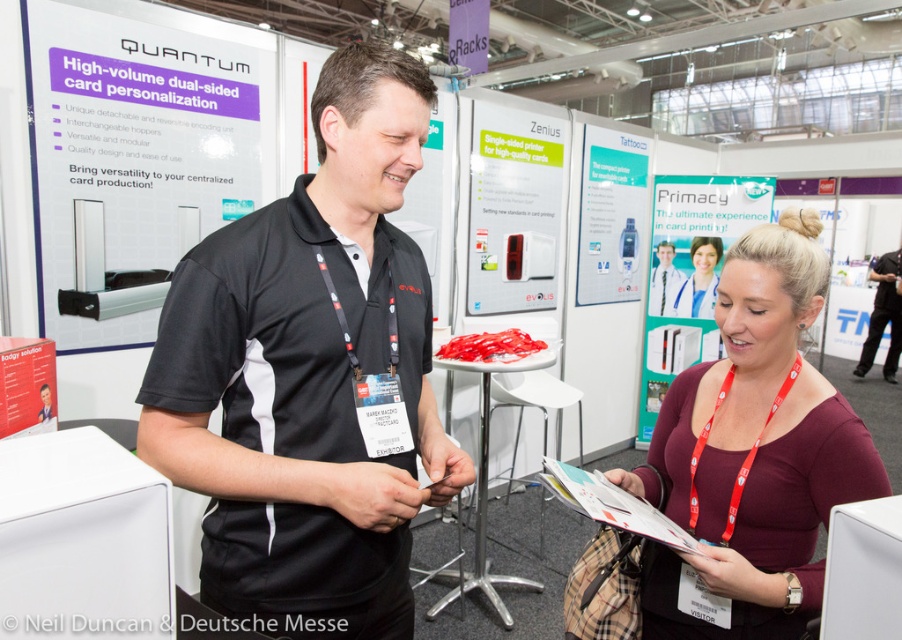
In the scene shown: Is maroon jersey at center positioned in front of white glossy printer at upper center?

Yes, maroon jersey at center is in front of white glossy printer at upper center.

Image resolution: width=902 pixels, height=640 pixels. What do you see at coordinates (753, 451) in the screenshot?
I see `maroon jersey at center` at bounding box center [753, 451].

In order to click on maroon jersey at center in this screenshot , I will do `click(753, 451)`.

Does silver metallic card personalization machine at upper left have a lesser width compared to white glossy printer at upper center?

Yes, silver metallic card personalization machine at upper left is thinner than white glossy printer at upper center.

Between silver metallic card personalization machine at upper left and white glossy printer at upper center, which one appears on the left side from the viewer's perspective?

Positioned to the left is silver metallic card personalization machine at upper left.

Identify the location of silver metallic card personalization machine at upper left. This screenshot has width=902, height=640. (129, 163).

Between silver metallic card personalization machine at upper left and matte white id card at center, which one has less height?

matte white id card at center is shorter.

Which of these two, silver metallic card personalization machine at upper left or matte white id card at center, stands taller?

With more height is silver metallic card personalization machine at upper left.

Is point (187, 108) closer to camera compared to point (712, 253)?

Yes, point (187, 108) is closer to viewer.

Find the location of `silver metallic card personalization machine at upper left`. silver metallic card personalization machine at upper left is located at coordinates (129, 163).